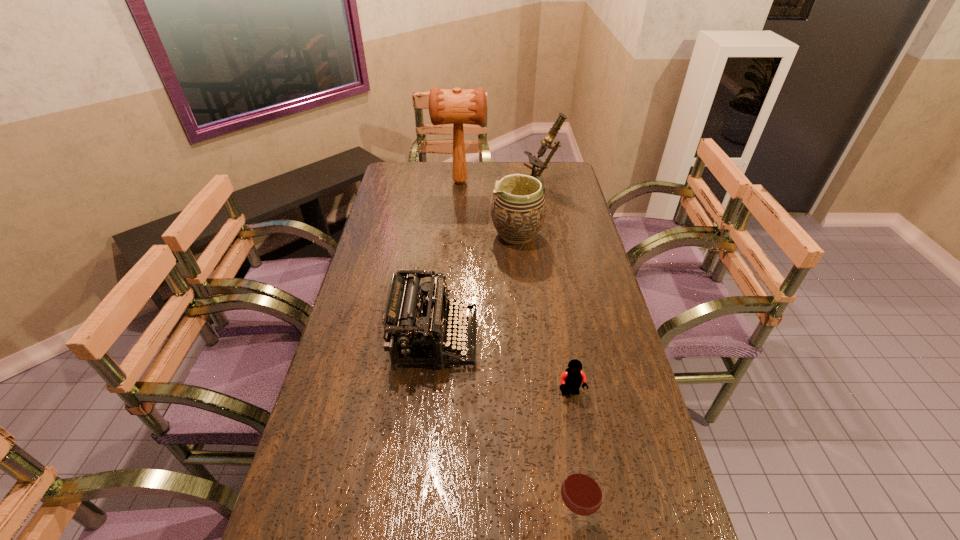
The image size is (960, 540). What are the coordinates of `vacant region located on the strike surface of the tallest object` in the screenshot? It's located at (536, 182).

Locate an element on the screen. The height and width of the screenshot is (540, 960). vacant space located at the eyepiece of the fifth shortest object is located at coordinates (497, 186).

Image resolution: width=960 pixels, height=540 pixels. In order to click on free space located 0.060m at the eyepiece of the fifth shortest object in this screenshot , I will do `click(509, 186)`.

Locate an element on the screen. The height and width of the screenshot is (540, 960). free location located 0.380m at the eyepiece of the fifth shortest object is located at coordinates (435, 186).

This screenshot has height=540, width=960. In order to click on free region located 0.200m on the front of the pottery in this screenshot , I will do `click(522, 290)`.

This screenshot has width=960, height=540. I want to click on vacant space situated 0.230m on the typing side of the fourth tallest object, so click(x=555, y=339).

Locate an element on the screen. vacant space located 0.190m on the left of the nearest object is located at coordinates (464, 517).

Find the location of a particular element. free space located on the front-facing side of the fifth farthest object is located at coordinates [576, 422].

Where is `mallet that is positioned at the far edge`? mallet that is positioned at the far edge is located at coordinates (469, 106).

I want to click on microscope located at the far edge, so click(x=536, y=163).